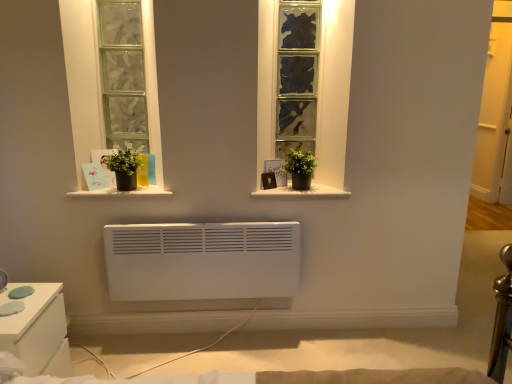
Where is `free spot below green matte plant pot at left, which appears as the second houseplant when viewed from the right (from a real-world perspective)`? free spot below green matte plant pot at left, which appears as the second houseplant when viewed from the right (from a real-world perspective) is located at coordinates (127, 194).